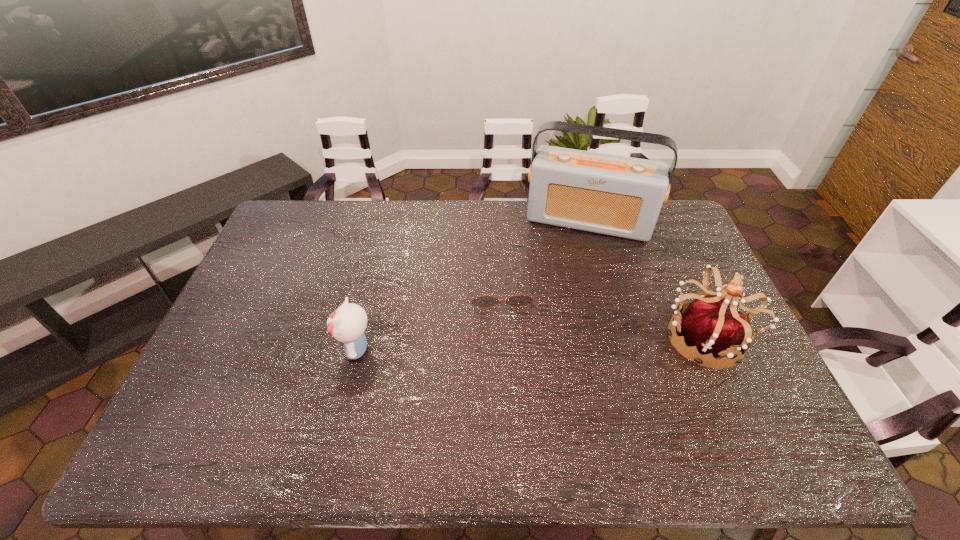
Where is `vacant point at the far edge`? The width and height of the screenshot is (960, 540). vacant point at the far edge is located at coordinates (559, 239).

Find the location of a particular element. The height and width of the screenshot is (540, 960). vacant space at the near edge of the desktop is located at coordinates (662, 410).

Where is `free space at the left edge`? free space at the left edge is located at coordinates (263, 342).

Find the location of `vacant space at the right edge of the desktop`. vacant space at the right edge of the desktop is located at coordinates (685, 272).

Image resolution: width=960 pixels, height=540 pixels. I want to click on free space at the near right corner, so click(x=746, y=390).

The height and width of the screenshot is (540, 960). What are the coordinates of `vacant area between the third tallest object and the farthest object` in the screenshot? It's located at (472, 285).

Where is `free space between the third tallest object and the third shortest object`? This screenshot has width=960, height=540. free space between the third tallest object and the third shortest object is located at coordinates 529,344.

Identify the location of vacant space in between the third tallest object and the radio receiver. (472, 285).

I want to click on vacant region between the tiara and the sunglasses, so click(x=601, y=315).

Image resolution: width=960 pixels, height=540 pixels. Identify the location of vacant point located between the shortest object and the tiara. (x=601, y=315).